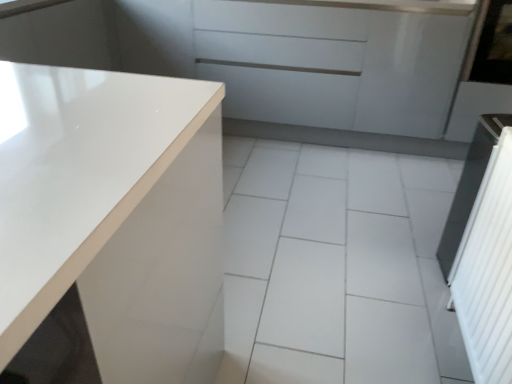
Question: Considering the relative positions of white glossy countertop at left and transparent glass window screen at upper right in the image provided, is white glossy countertop at left behind transparent glass window screen at upper right?

Choices:
 (A) yes
 (B) no

Answer: (B)

Question: Can we say white glossy countertop at left lies outside transparent glass window screen at upper right?

Choices:
 (A) yes
 (B) no

Answer: (A)

Question: Can you confirm if white glossy countertop at left is positioned to the left of transparent glass window screen at upper right?

Choices:
 (A) yes
 (B) no

Answer: (A)

Question: Is the surface of white glossy countertop at left in direct contact with transparent glass window screen at upper right?

Choices:
 (A) yes
 (B) no

Answer: (B)

Question: Is white glossy countertop at left aimed at transparent glass window screen at upper right?

Choices:
 (A) no
 (B) yes

Answer: (A)

Question: From the image's perspective, is white glossy countertop at left over transparent glass window screen at upper right?

Choices:
 (A) yes
 (B) no

Answer: (B)

Question: Is the depth of glossy white screen door at right, which is counted as the second screen door, starting from the left, greater than that of transparent glass window screen at upper right?

Choices:
 (A) yes
 (B) no

Answer: (B)

Question: From the image's perspective, is glossy white screen door at right, which is counted as the second screen door, starting from the left, beneath transparent glass window screen at upper right?

Choices:
 (A) no
 (B) yes

Answer: (B)

Question: From the image's perspective, is glossy white screen door at right, the 2th screen door when ordered from front to back, on transparent glass window screen at upper right?

Choices:
 (A) yes
 (B) no

Answer: (B)

Question: Considering the relative sizes of glossy white screen door at right, placed as the 1th screen door when sorted from top to bottom, and transparent glass window screen at upper right in the image provided, is glossy white screen door at right, placed as the 1th screen door when sorted from top to bottom, thinner than transparent glass window screen at upper right?

Choices:
 (A) no
 (B) yes

Answer: (B)

Question: Are glossy white screen door at right, acting as the first screen door starting from the back, and transparent glass window screen at upper right located far from each other?

Choices:
 (A) yes
 (B) no

Answer: (B)

Question: Is glossy white screen door at right, which is counted as the second screen door, starting from the left, located outside transparent glass window screen at upper right?

Choices:
 (A) no
 (B) yes

Answer: (A)

Question: Is white glossy countertop at left closer to the viewer compared to white glossy tile at center?

Choices:
 (A) no
 (B) yes

Answer: (B)